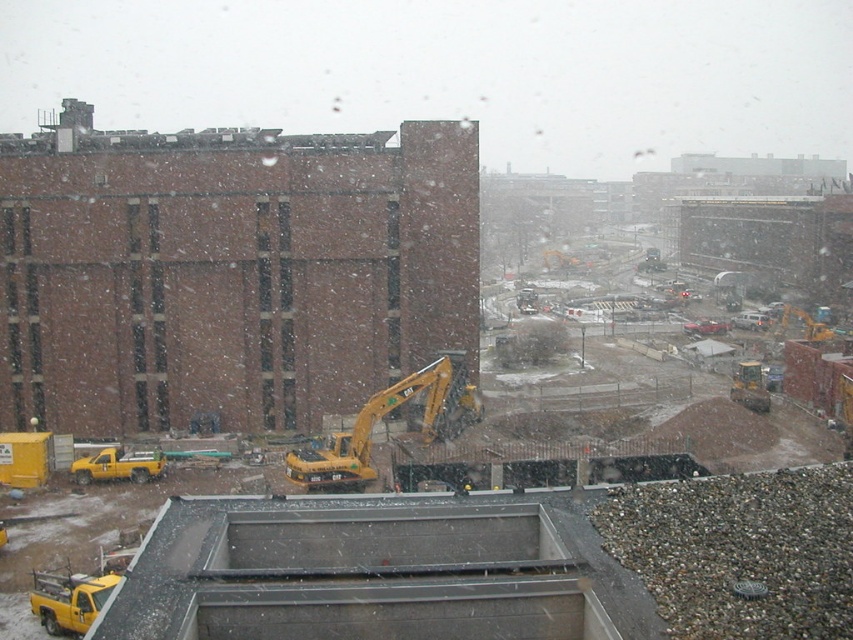
Looking at this image, how distant is matte yellow truck at lower left from yellow rubber tractor at lower right?

matte yellow truck at lower left and yellow rubber tractor at lower right are 121.89 feet apart from each other.

Between matte yellow truck at lower left and yellow rubber tractor at lower right, which one appears on the left side from the viewer's perspective?

matte yellow truck at lower left

This screenshot has height=640, width=853. Find the location of `matte yellow truck at lower left`. matte yellow truck at lower left is located at coordinates (68, 600).

Where is `matte yellow truck at lower left`? The image size is (853, 640). matte yellow truck at lower left is located at coordinates (68, 600).

Is point (375, 410) positioned in front of point (77, 476)?

Yes, point (375, 410) is closer to viewer.

Is yellow rubber excavator at center below yellow matte truck at lower left?

No.

Who is more distant from viewer, (374, 394) or (157, 454)?

Point (374, 394)

Locate an element on the screen. yellow rubber excavator at center is located at coordinates (381, 417).

Who is shorter, brick building at left or matte yellow truck at lower left?

Standing shorter between the two is matte yellow truck at lower left.

Does brick building at left appear on the left side of matte yellow truck at lower left?

Yes, brick building at left is to the left of matte yellow truck at lower left.

Is point (49, 358) farther from camera compared to point (97, 586)?

Yes.

Locate an element on the screen. This screenshot has height=640, width=853. brick building at left is located at coordinates (228, 272).